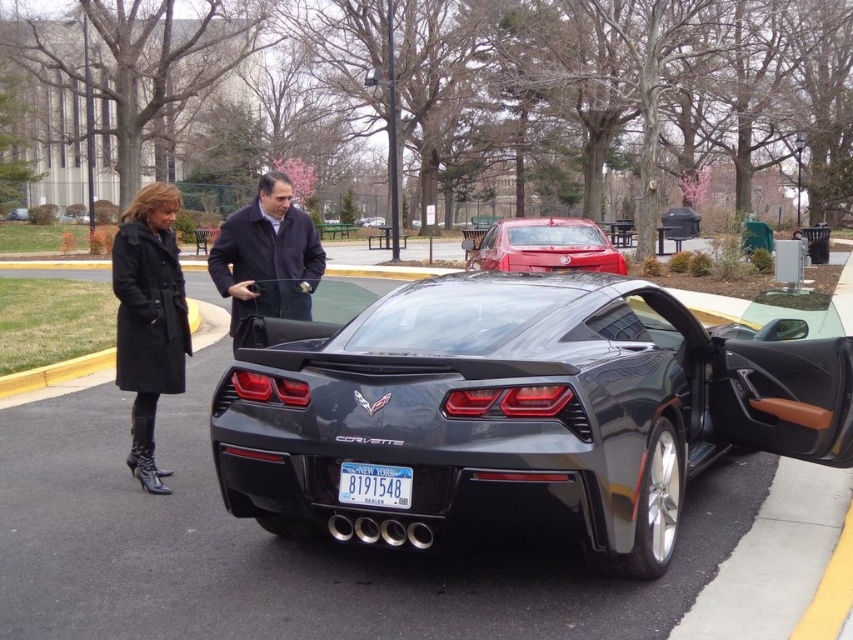
Question: Which of the following is the closest to the observer?

Choices:
 (A) click(x=450, y=438)
 (B) click(x=67, y=378)
 (C) click(x=367, y=224)
 (D) click(x=323, y=273)

Answer: (A)

Question: Is shiny black car at center further to the viewer compared to blue metallic license plate at center?

Choices:
 (A) no
 (B) yes

Answer: (A)

Question: Which of the following is the closest to the observer?

Choices:
 (A) (376, 493)
 (B) (373, 227)
 (C) (224, 250)
 (D) (86, 364)

Answer: (A)

Question: Among these points, which one is farthest from the camera?

Choices:
 (A) (239, 241)
 (B) (300, 401)
 (C) (380, 477)

Answer: (A)

Question: Is shiny red sedan at center wider than satin black sports car at center?

Choices:
 (A) yes
 (B) no

Answer: (A)

Question: Does dark gray coat at center appear on the right side of black rubber curb at lower left?

Choices:
 (A) yes
 (B) no

Answer: (A)